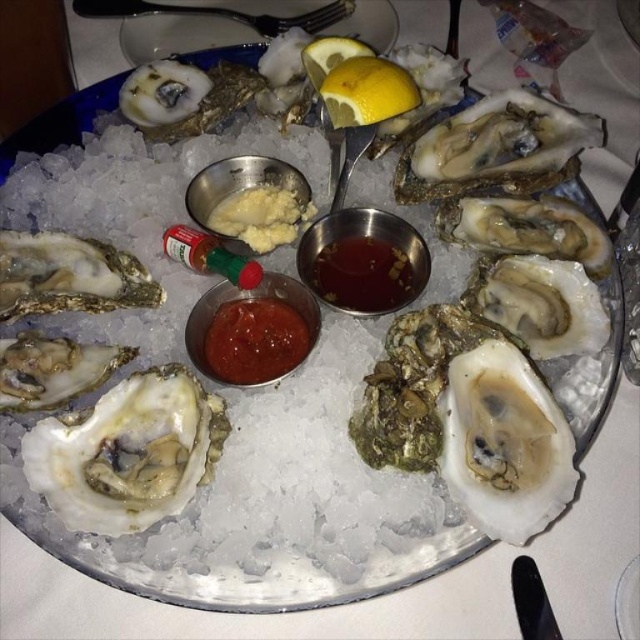
Can you confirm if white glossy oyster at lower right is smaller than white shell oyster at left?

No.

Between point (456, 452) and point (100, 268), which one is positioned in front?

Point (456, 452) is in front.

Between point (493, 392) and point (93, 264), which one is positioned behind?

Point (93, 264)

Locate an element on the screen. This screenshot has height=640, width=640. white glossy oyster at lower right is located at coordinates (506, 444).

I want to click on white glossy oyster at lower right, so click(506, 444).

Is point (492, 477) positioned behind point (387, 269)?

No, (492, 477) is closer to viewer.

At what (x,y) coordinates should I click in order to perform the action: click on white glossy oyster at lower right. Please return your answer as a coordinate pair (x, y). Looking at the image, I should click on (506, 444).

Can you confirm if white shell oyster at left is positioned to the right of yellow matte lemon at center?

Incorrect, white shell oyster at left is not on the right side of yellow matte lemon at center.

Who is shorter, white shell oyster at left or yellow matte lemon at center?

yellow matte lemon at center

In order to click on white shell oyster at left in this screenshot , I will do `click(68, 275)`.